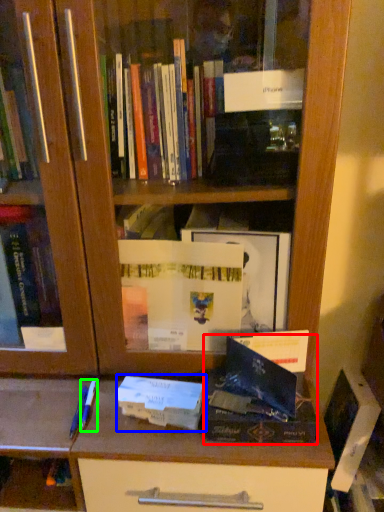
Question: Considering the real-world distances, which object is farthest from paperback book (highlighted by a red box)? paperback book (highlighted by a blue box) or pen (highlighted by a green box)?

Choices:
 (A) paperback book
 (B) pen

Answer: (B)